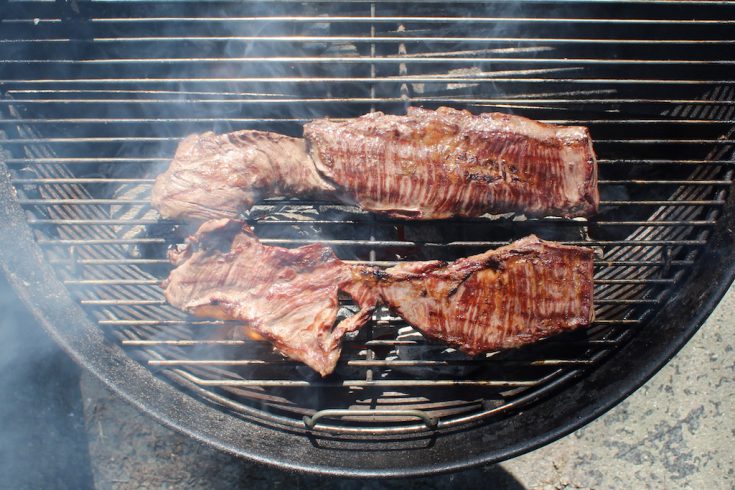
The height and width of the screenshot is (490, 735). What are the coordinates of `handle` in the screenshot? It's located at (372, 414).